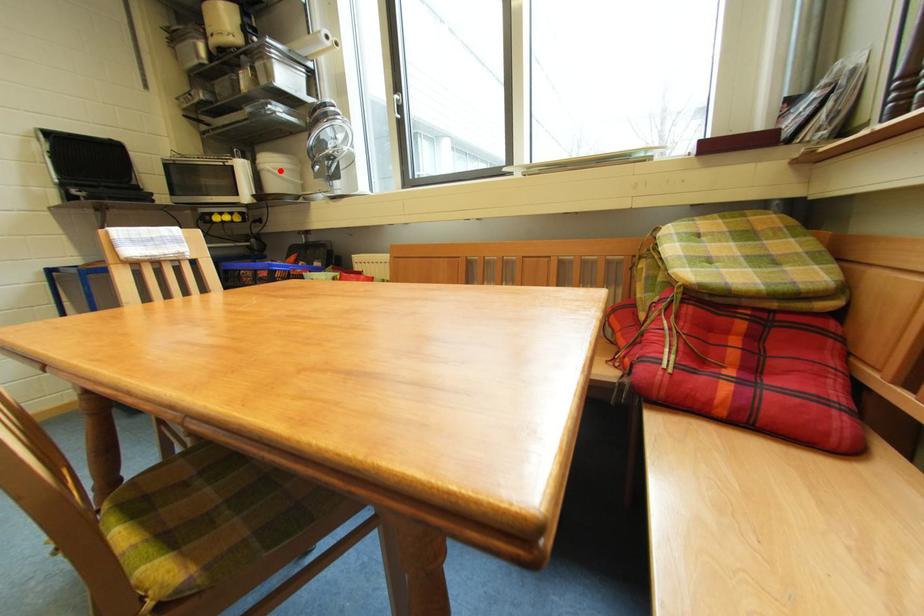
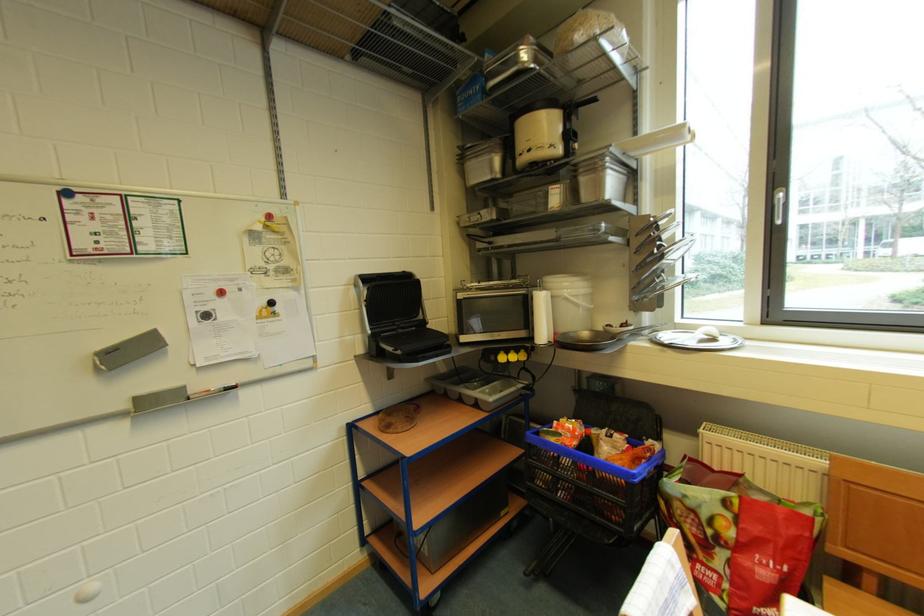
Where in the second image is the point corresponding to the highlighted location from the first image?

(578, 299)